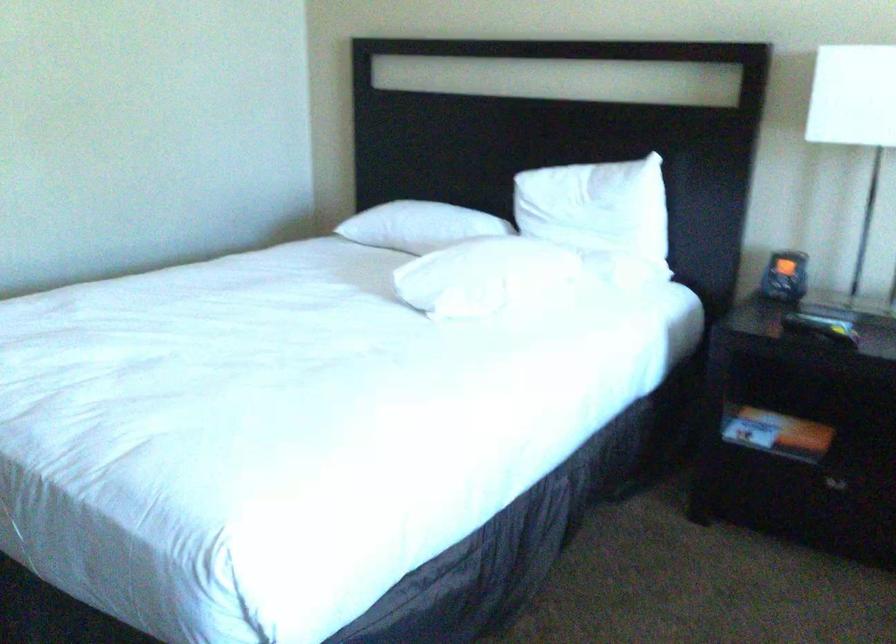
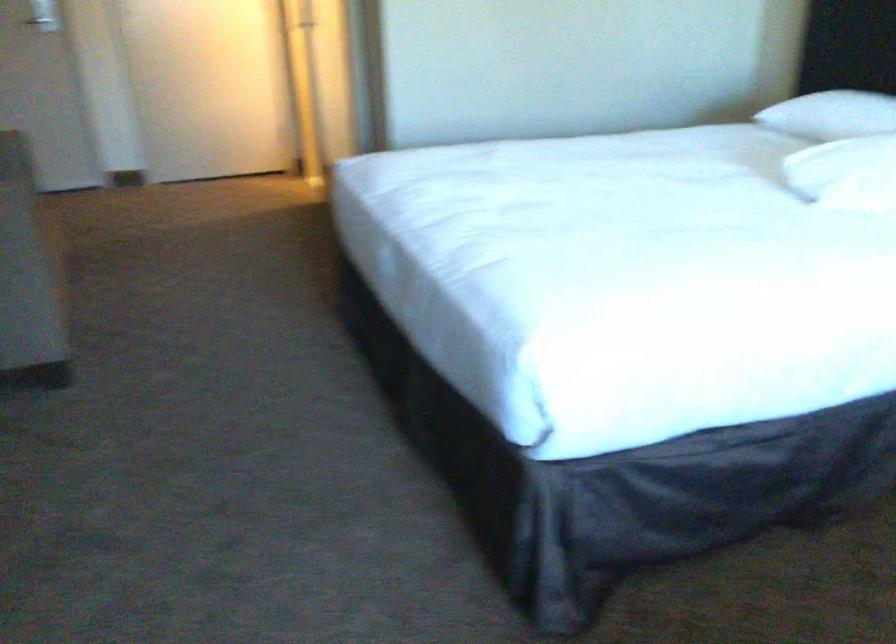
Where in the second image is the point corresponding to (453,290) from the first image?

(846, 173)